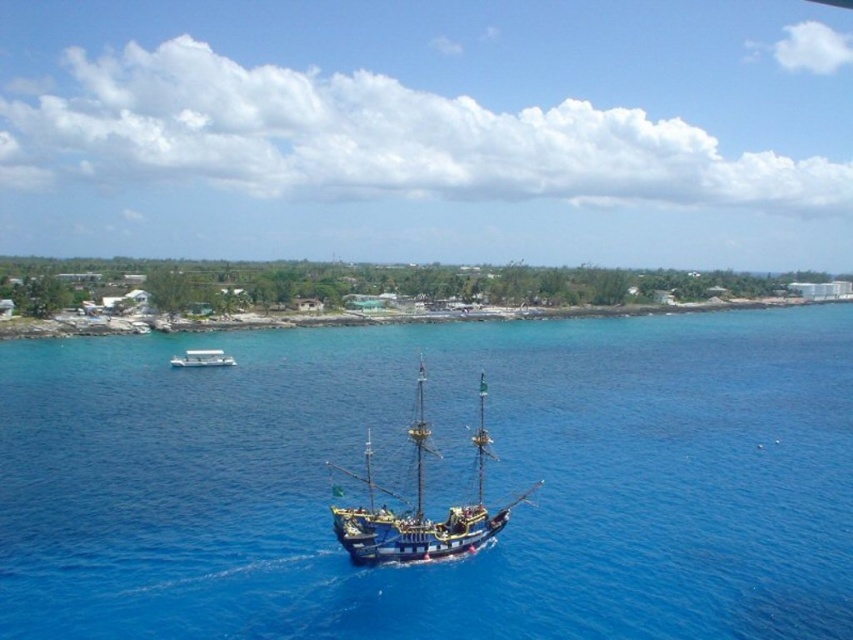
Question: Which point is closer to the camera?

Choices:
 (A) white plastic boat at lower left
 (B) blue water at center
 (C) wooden pirate ship at center

Answer: (B)

Question: Does wooden pirate ship at center have a greater width compared to white plastic boat at lower left?

Choices:
 (A) yes
 (B) no

Answer: (A)

Question: Which object is closer to the camera taking this photo?

Choices:
 (A) blue water at center
 (B) white plastic boat at lower left
 (C) wooden pirate ship at center

Answer: (A)

Question: Does wooden pirate ship at center have a greater width compared to white plastic boat at lower left?

Choices:
 (A) yes
 (B) no

Answer: (A)

Question: Considering the real-world distances, which object is closest to the white plastic boat at lower left?

Choices:
 (A) blue water at center
 (B) wooden pirate ship at center

Answer: (A)

Question: From the image, what is the correct spatial relationship of wooden pirate ship at center in relation to white plastic boat at lower left?

Choices:
 (A) below
 (B) above

Answer: (A)